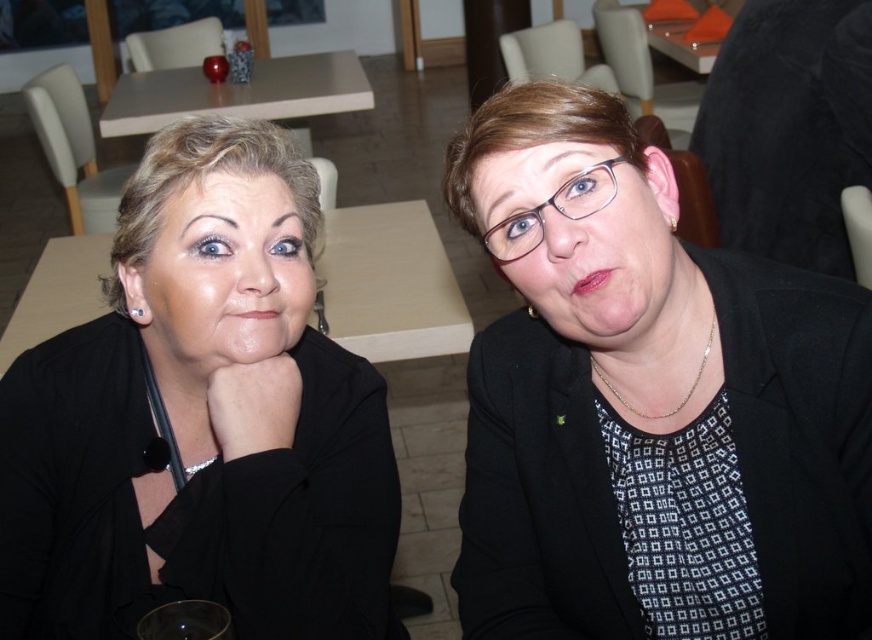
You are a photographer trying to capture a closeup shot of both the matte black face at center and the matte black glasses at center. Since both are matte black, you need to adjust your camera settings to ensure proper focus. Which object should you focus on first to ensure both are in focus given their positions?

The matte black face at center is located below the matte black glasses at center. To ensure both are in focus, you should focus on the matte black glasses at center first since it is closer to the camera.

Based on the scene described, which object is positioned to the right of the other between the matte black jacket at left and the matte wood table at upper center?

The matte black jacket at left is positioned to the right of the matte wood table at upper center according to the description.